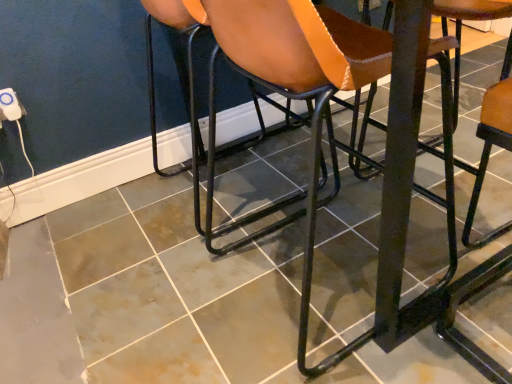
Find the location of a particular element. This screenshot has width=512, height=384. free space to the left of brown leather chair at center, positioned as the second chair in left-to-right order is located at coordinates (163, 299).